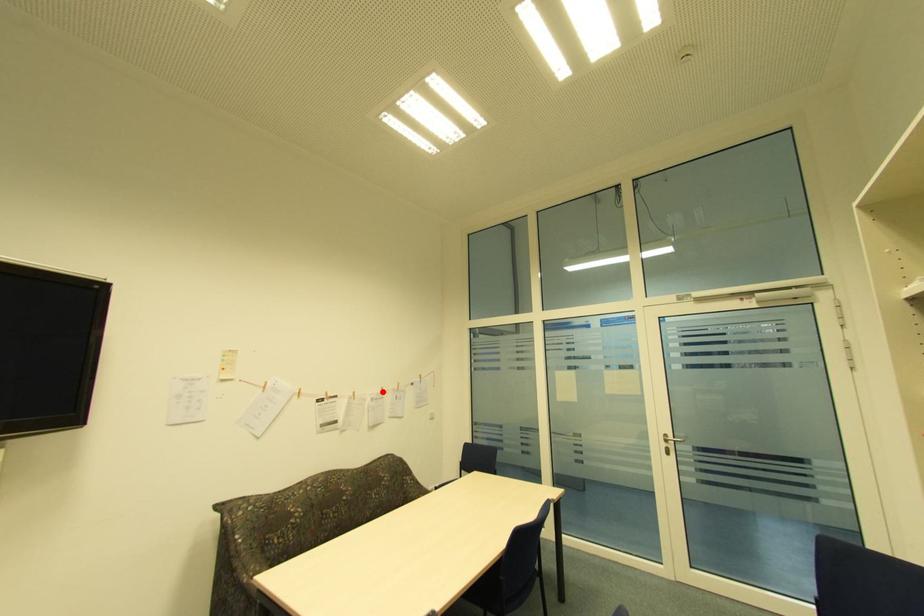
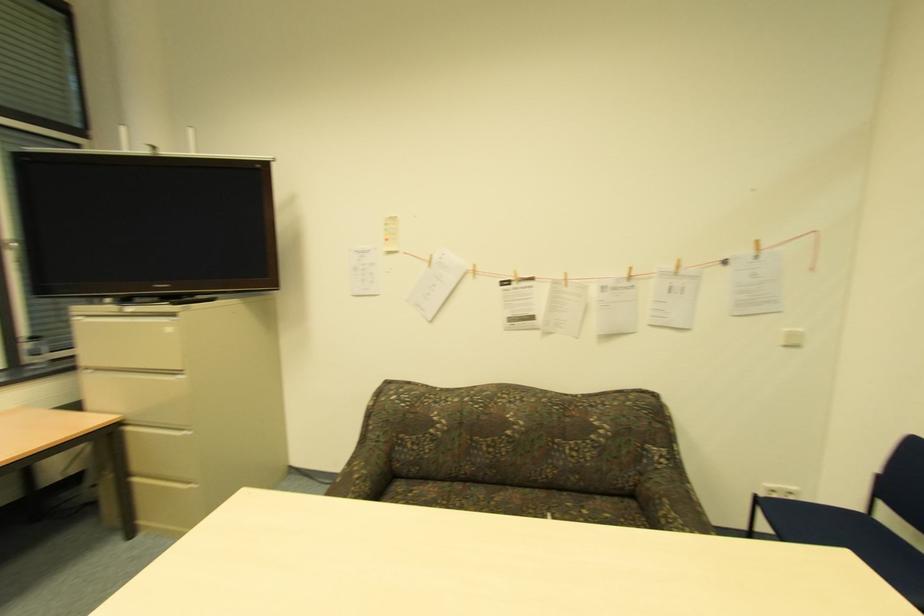
Locate, in the second image, the point that corresponds to the highlighted location in the first image.

(626, 276)